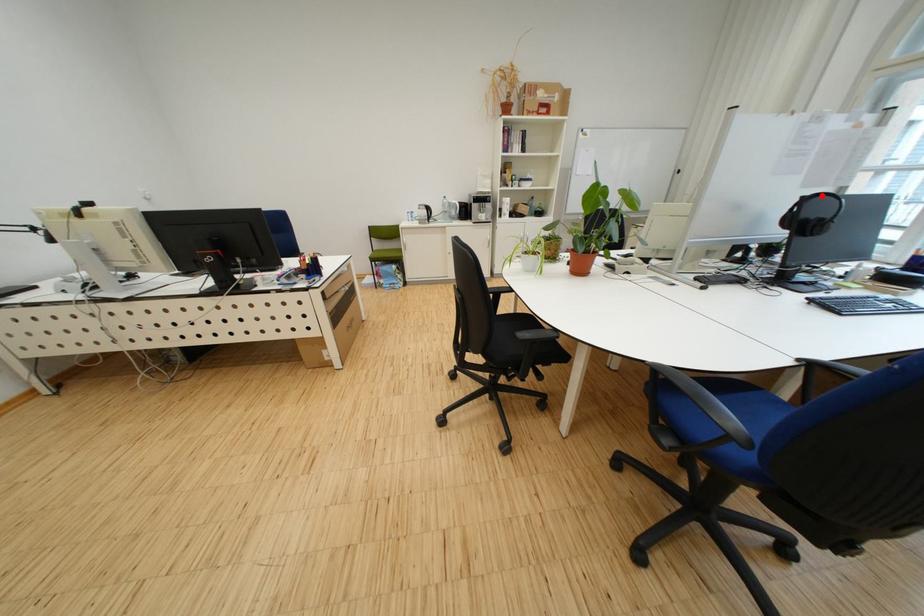
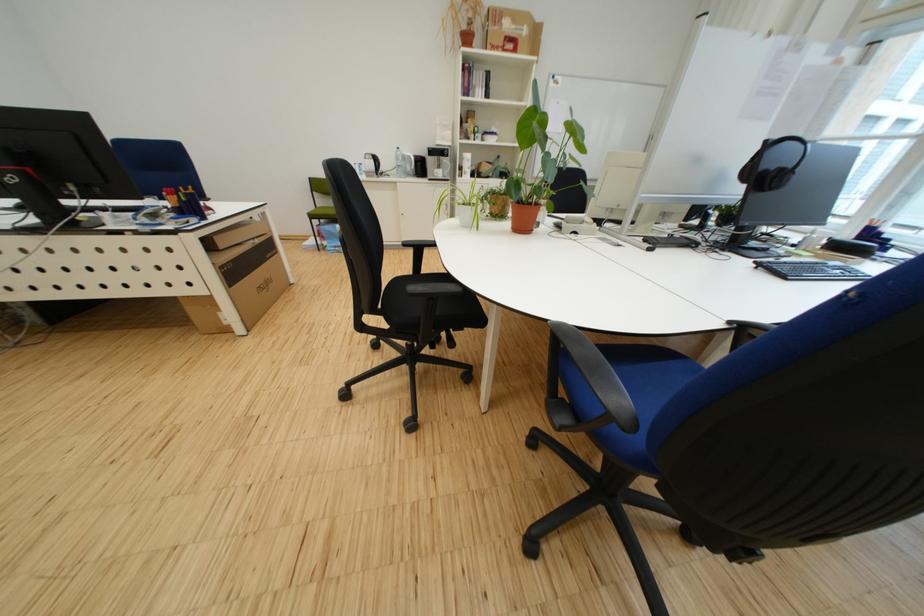
Where in the second image is the point corresponding to the highlighted location from the first image?

(786, 140)